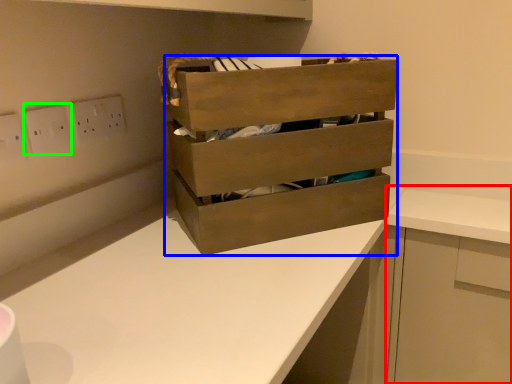
Question: Which is nearer to the cabinetry (highlighted by a red box)? chest of drawers (highlighted by a blue box) or electric outlet (highlighted by a green box).

Choices:
 (A) chest of drawers
 (B) electric outlet

Answer: (A)